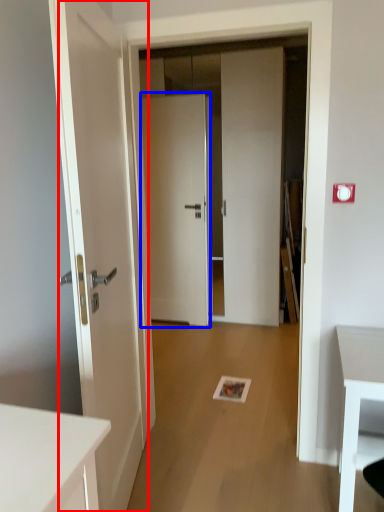
Question: Which point is further to the camera, door (highlighted by a red box) or door (highlighted by a blue box)?

Choices:
 (A) door
 (B) door

Answer: (B)